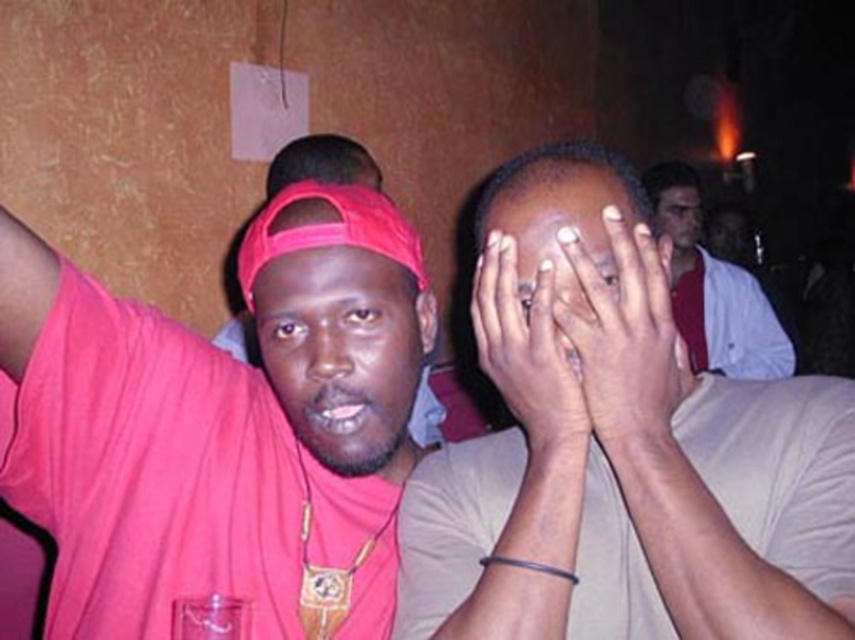
You are a photographer adjusting your camera settings to focus on the matte red cap at center and the smooth skin at center. Which object should you adjust your focus to first if you want to capture both in sharp detail?

The matte red cap at center is closer to the viewer than the smooth skin at center, so you should focus on the matte red cap at center first to ensure both are in sharp detail.

You are standing in the center of the room and want to locate the matte red cap at center. According to the coordinates provided, in which direction should you look to find it?

The matte red cap at center is located at coordinates point (x=345, y=353), so you should look slightly to the right and down from the center to find it.